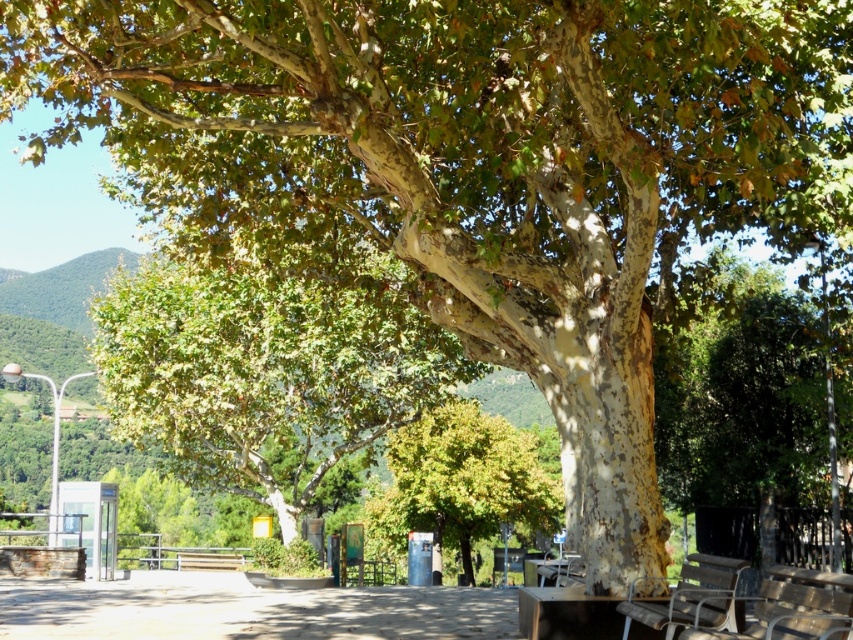
Who is taller, metallic silver bench at lower right or wooden bench at lower right?

metallic silver bench at lower right

Where is `metallic silver bench at lower right`? metallic silver bench at lower right is located at coordinates (793, 608).

Does point (189, 397) come behind point (476, 476)?

No, it is not.

Where is `green rough bark tree at center`? The width and height of the screenshot is (853, 640). green rough bark tree at center is located at coordinates (264, 371).

Does point (357, 336) come in front of point (426, 477)?

Yes, point (357, 336) is closer to viewer.

At what (x,y) coordinates should I click in order to perform the action: click on green rough bark tree at center. Please return your answer as a coordinate pair (x, y). The width and height of the screenshot is (853, 640). Looking at the image, I should click on (264, 371).

Is green rough bark tree at center positioned behind metallic silver bench at lower right?

Yes, green rough bark tree at center is further from the viewer.

Can you confirm if green rough bark tree at center is positioned to the right of metallic silver bench at lower right?

Incorrect, green rough bark tree at center is not on the right side of metallic silver bench at lower right.

At what (x,y) coordinates should I click in order to perform the action: click on green rough bark tree at center. Please return your answer as a coordinate pair (x, y). This screenshot has width=853, height=640. Looking at the image, I should click on (264, 371).

Find the location of a particular element. The height and width of the screenshot is (640, 853). green rough bark tree at center is located at coordinates (264, 371).